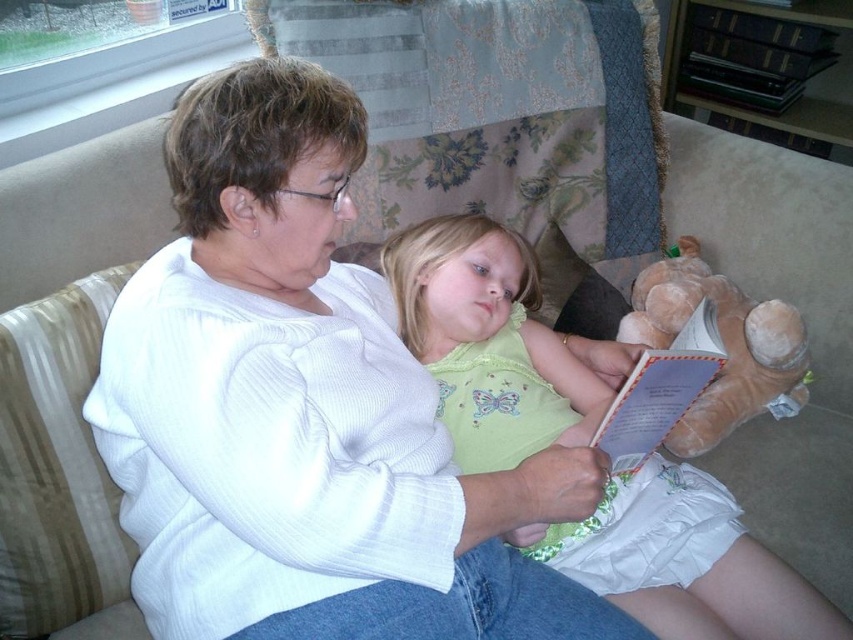
In the scene shown: Between light green fabric dress at center and soft brown plush at lower right, which one appears on the right side from the viewer's perspective?

Positioned to the right is soft brown plush at lower right.

Is light green fabric dress at center thinner than soft brown plush at lower right?

No, light green fabric dress at center is not thinner than soft brown plush at lower right.

Identify the location of light green fabric dress at center. (488, 340).

Which of these two, white ribbed sweater at center or soft brown plush at lower right, stands taller?

Standing taller between the two is white ribbed sweater at center.

Image resolution: width=853 pixels, height=640 pixels. Identify the location of white ribbed sweater at center. (305, 410).

The image size is (853, 640). Identify the location of white ribbed sweater at center. (305, 410).

Does white ribbed sweater at center lie in front of light green fabric dress at center?

Yes, white ribbed sweater at center is in front of light green fabric dress at center.

Image resolution: width=853 pixels, height=640 pixels. What do you see at coordinates (305, 410) in the screenshot? I see `white ribbed sweater at center` at bounding box center [305, 410].

Measure the distance between point (x=554, y=449) and camera.

A distance of 35.95 inches exists between point (x=554, y=449) and camera.

Find the location of a particular element. The width and height of the screenshot is (853, 640). white ribbed sweater at center is located at coordinates (305, 410).